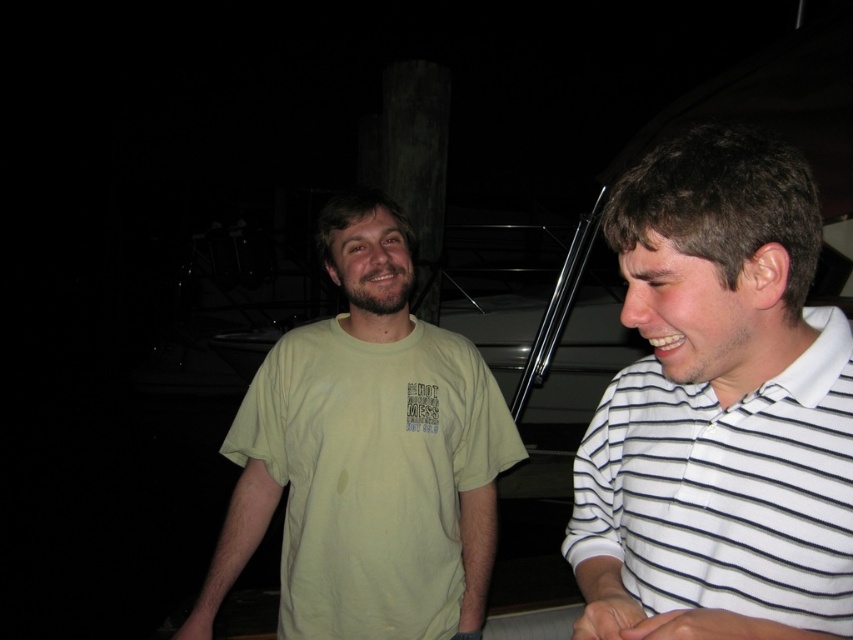
Question: Is white striped polo shirt at right bigger than light green t-shirt at center?

Choices:
 (A) yes
 (B) no

Answer: (B)

Question: Which object is closer to the camera taking this photo?

Choices:
 (A) white striped polo shirt at right
 (B) light green t-shirt at center

Answer: (A)

Question: Can you confirm if white striped polo shirt at right is wider than light green t-shirt at center?

Choices:
 (A) yes
 (B) no

Answer: (B)

Question: Which object appears closest to the camera in this image?

Choices:
 (A) light green t-shirt at center
 (B) white striped polo shirt at right

Answer: (B)

Question: Can you confirm if white striped polo shirt at right is bigger than light green t-shirt at center?

Choices:
 (A) no
 (B) yes

Answer: (A)